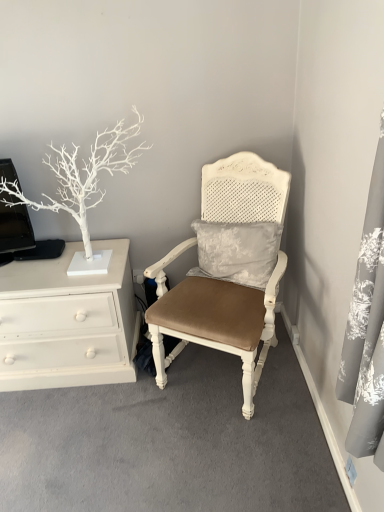
Question: Is white matte tree at left looking in the opposite direction of white painted wood chest of drawers at left?

Choices:
 (A) yes
 (B) no

Answer: (B)

Question: Does white matte tree at left come in front of white painted wood chest of drawers at left?

Choices:
 (A) yes
 (B) no

Answer: (A)

Question: Is white matte tree at left facing towards white painted wood chest of drawers at left?

Choices:
 (A) yes
 (B) no

Answer: (B)

Question: Is white matte tree at left at the left side of white painted wood chest of drawers at left?

Choices:
 (A) no
 (B) yes

Answer: (A)

Question: From a real-world perspective, is white matte tree at left on top of white painted wood chest of drawers at left?

Choices:
 (A) no
 (B) yes

Answer: (B)

Question: In the image, is white matte tree at left positioned in front of or behind white painted wood chest of drawers at left?

Choices:
 (A) front
 (B) behind

Answer: (A)

Question: From their relative heights in the image, would you say white matte tree at left is taller or shorter than white painted wood chest of drawers at left?

Choices:
 (A) short
 (B) tall

Answer: (B)

Question: Which is correct: white matte tree at left is inside white painted wood chest of drawers at left, or outside of it?

Choices:
 (A) inside
 (B) outside

Answer: (B)

Question: Considering the positions of point 38,207 and point 81,245, is point 38,207 closer or farther from the camera than point 81,245?

Choices:
 (A) closer
 (B) farther

Answer: (A)

Question: Based on their sizes in the image, would you say white painted wood chest of drawers at left is bigger or smaller than white matte tree at left?

Choices:
 (A) small
 (B) big

Answer: (B)

Question: Based on their positions, is white painted wood chest of drawers at left located to the left or right of white matte tree at left?

Choices:
 (A) right
 (B) left

Answer: (B)

Question: Is white painted wood chest of drawers at left taller or shorter than white matte tree at left?

Choices:
 (A) short
 (B) tall

Answer: (A)

Question: Is white painted wood chest of drawers at left inside or outside of white matte tree at left?

Choices:
 (A) outside
 (B) inside

Answer: (A)

Question: From the image's perspective, is white painted wood chest of drawers at left positioned above or below matte white chair at center?

Choices:
 (A) above
 (B) below

Answer: (B)

Question: In terms of width, does white painted wood chest of drawers at left look wider or thinner when compared to matte white chair at center?

Choices:
 (A) thin
 (B) wide

Answer: (A)